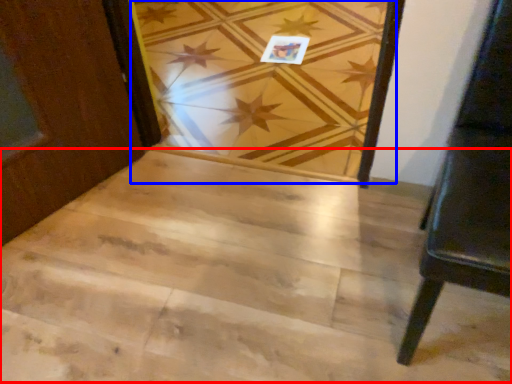
Question: Among these objects, which one is nearest to the camera, stairwell (highlighted by a red box) or plank (highlighted by a blue box)?

Choices:
 (A) stairwell
 (B) plank

Answer: (A)